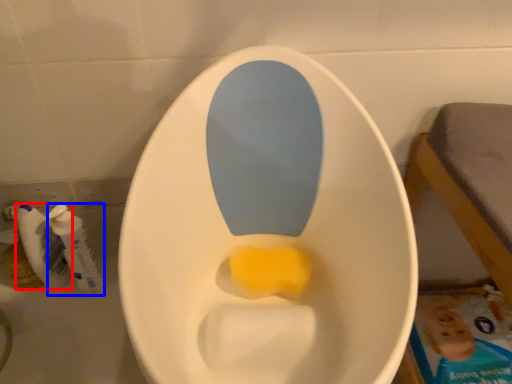
Question: Which object appears farthest to the camera in this image, mouthwash (highlighted by a red box) or mouthwash (highlighted by a blue box)?

Choices:
 (A) mouthwash
 (B) mouthwash

Answer: (A)